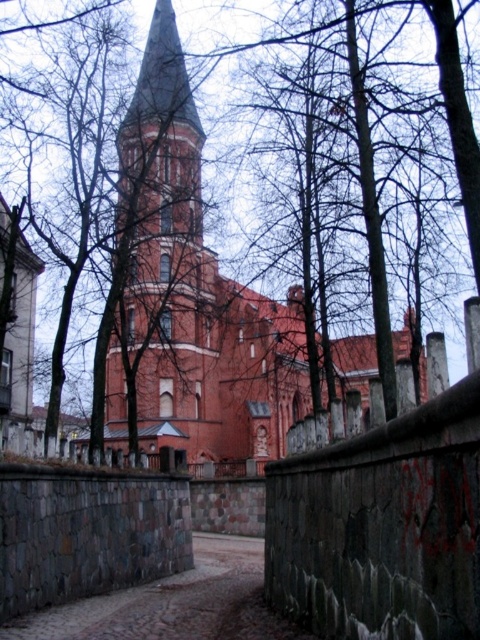
Question: Among these points, which one is nearest to the camera?

Choices:
 (A) (408, 432)
 (B) (158, 308)

Answer: (A)

Question: Which object is closer to the camera taking this photo?

Choices:
 (A) weathered stone wall at center
 (B) red brick church at center

Answer: (A)

Question: Is red brick church at center bigger than weathered stone wall at center?

Choices:
 (A) no
 (B) yes

Answer: (B)

Question: Is red brick church at center smaller than weathered stone wall at center?

Choices:
 (A) yes
 (B) no

Answer: (B)

Question: Is red brick church at center below weathered stone wall at center?

Choices:
 (A) no
 (B) yes

Answer: (A)

Question: Which object is farther from the camera taking this photo?

Choices:
 (A) red brick church at center
 (B) weathered stone wall at center

Answer: (A)